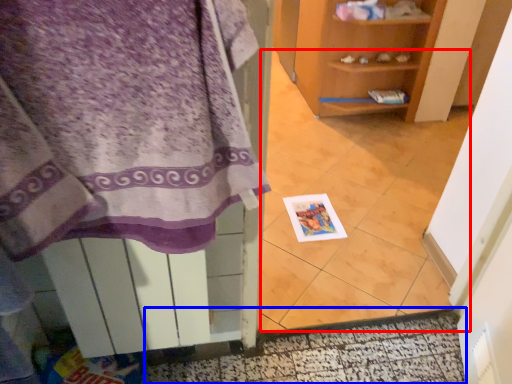
Question: Among these objects, which one is farthest to the camera, tile (highlighted by a red box) or door (highlighted by a blue box)?

Choices:
 (A) tile
 (B) door

Answer: (B)